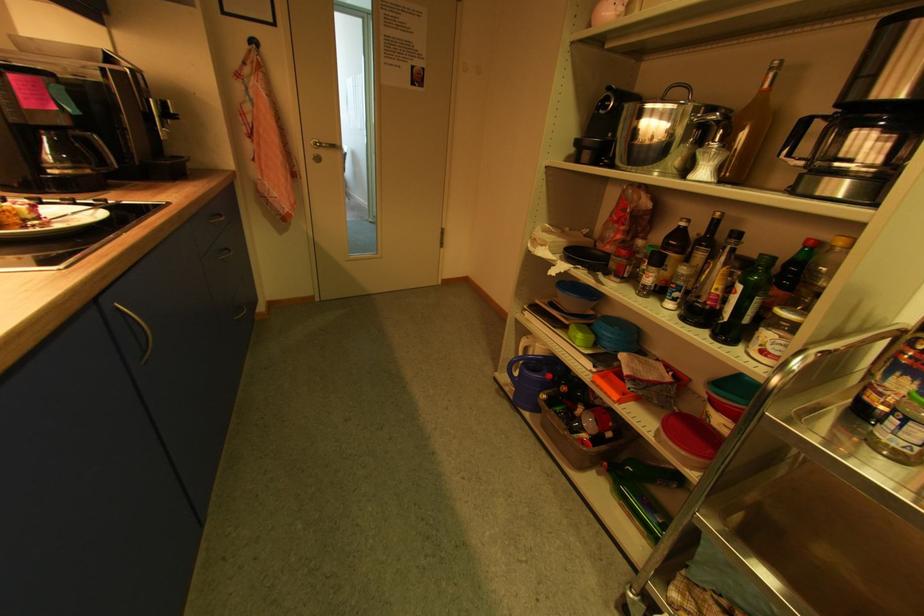
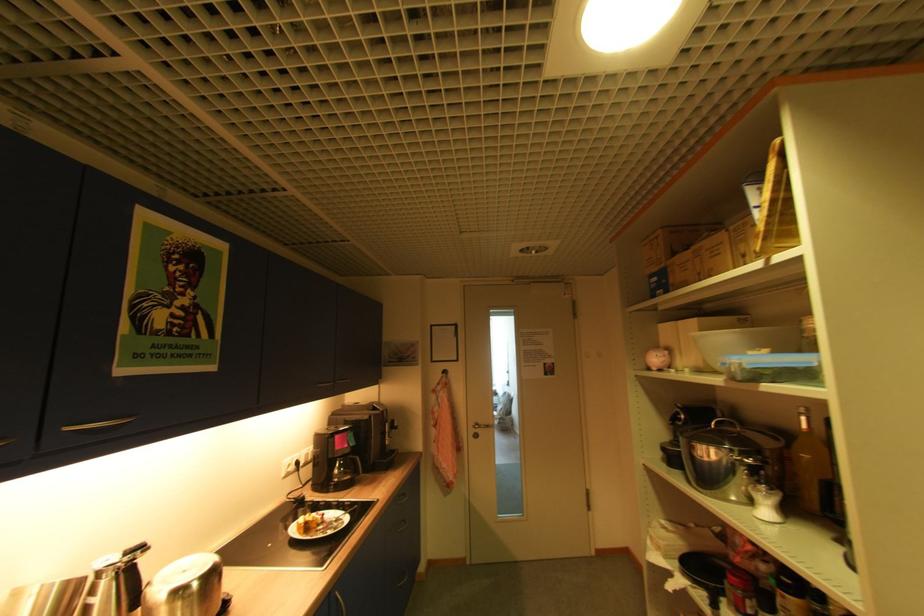
How did the camera likely rotate?

The rotation direction of the camera is left-up.